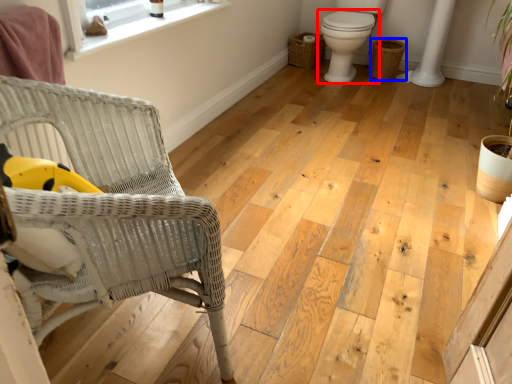
Question: Among these objects, which one is farthest to the camera, toilet (highlighted by a red box) or basket (highlighted by a blue box)?

Choices:
 (A) toilet
 (B) basket

Answer: (B)